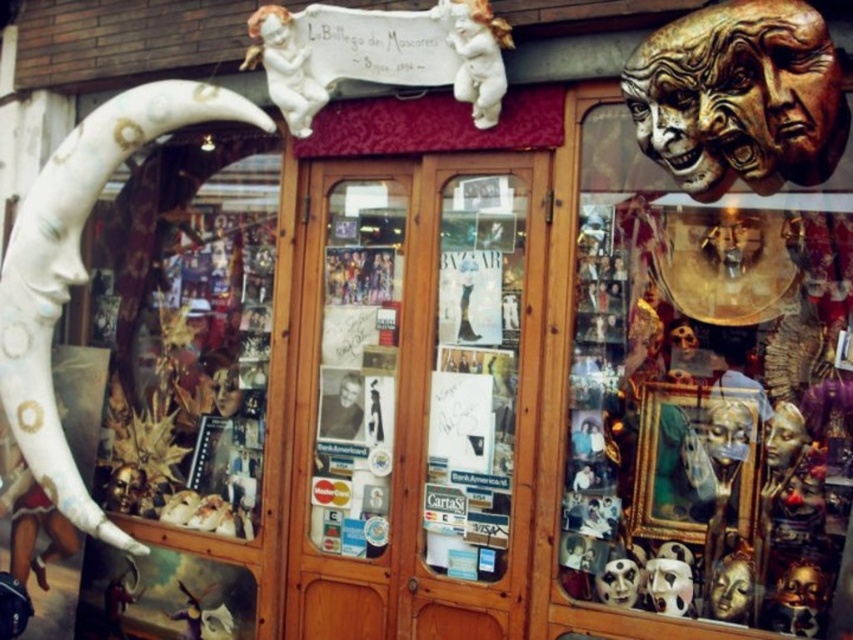
Is gold metallic mask at upper center closer to the viewer compared to wooden glass door at center?

Yes, gold metallic mask at upper center is in front of wooden glass door at center.

Can you confirm if gold metallic mask at upper center is positioned to the right of wooden glass door at center?

Yes, gold metallic mask at upper center is to the right of wooden glass door at center.

Is point (705, 426) less distant than point (379, 429)?

Yes, it is.

Where is `gold metallic mask at upper center`? Image resolution: width=853 pixels, height=640 pixels. gold metallic mask at upper center is located at coordinates (705, 396).

Is gold metallic mask at upper center smaller than white painted wood at left?

Result: Indeed, gold metallic mask at upper center has a smaller size compared to white painted wood at left.

Between gold metallic mask at upper center and white painted wood at left, which one appears on the right side from the viewer's perspective?

Positioned to the right is gold metallic mask at upper center.

This screenshot has width=853, height=640. Describe the element at coordinates (705, 396) in the screenshot. I see `gold metallic mask at upper center` at that location.

Locate an element on the screen. gold metallic mask at upper center is located at coordinates (705, 396).

Is point (465, 568) in front of point (158, 92)?

Yes, it is.

Is wooden glass door at center taller than white painted wood at left?

Incorrect, wooden glass door at center's height is not larger of white painted wood at left's.

Is point (496, 216) positioned before point (154, 86)?

Yes, point (496, 216) is in front of point (154, 86).

Where is `wooden glass door at center`? wooden glass door at center is located at coordinates (415, 397).